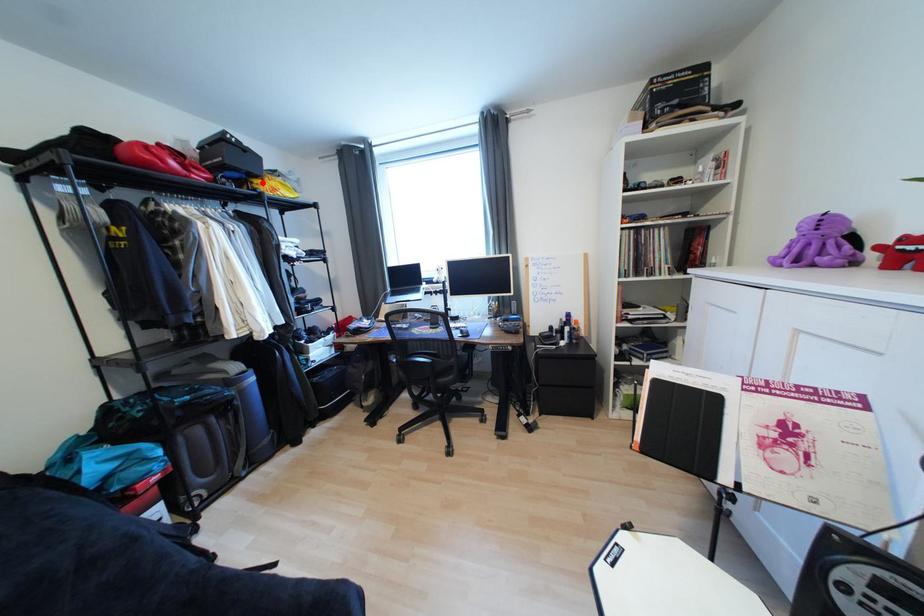
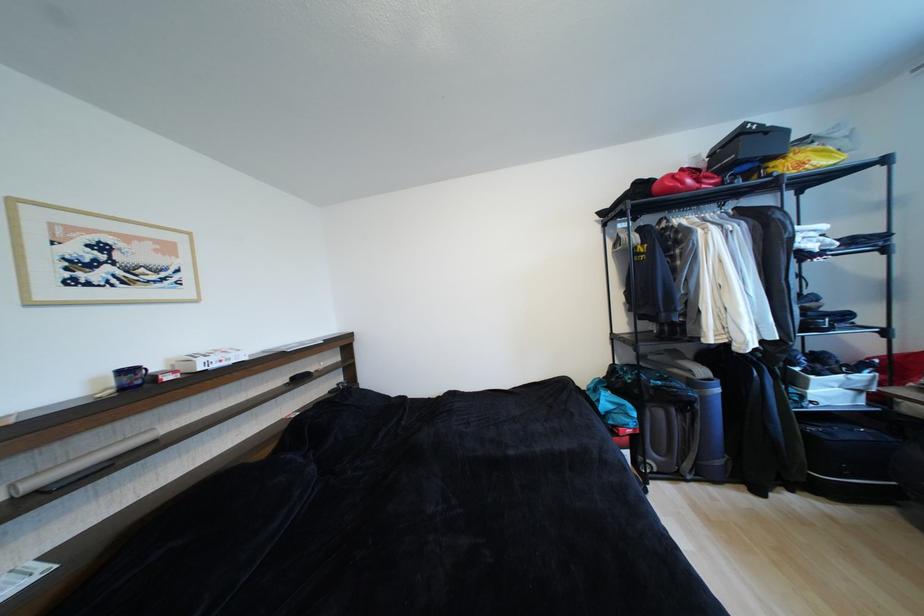
In the second image, find the point that corresponds to the highlighted location in the first image.

(780, 166)